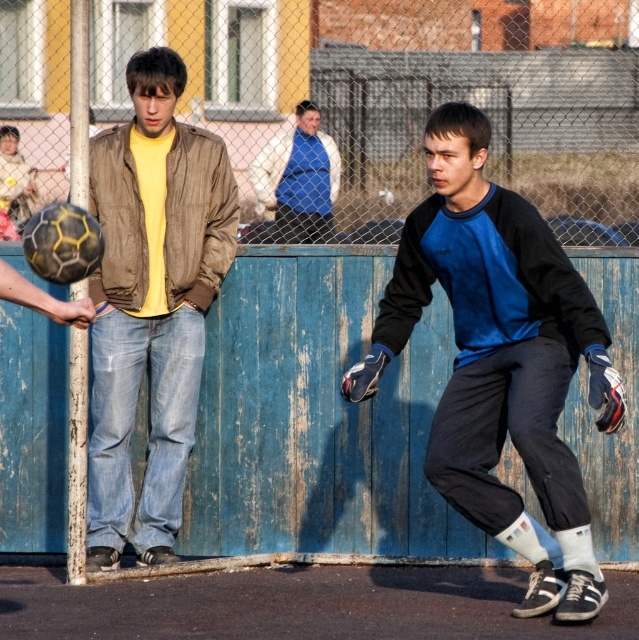
Question: Which of the following is the farthest from the observer?

Choices:
 (A) blue fleece jacket at center
 (B) blue velour jacket at center

Answer: (A)

Question: Is blue velour jacket at center below blue fleece jacket at center?

Choices:
 (A) no
 (B) yes

Answer: (B)

Question: Does blue velour jacket at center have a greater width compared to blue fleece jacket at center?

Choices:
 (A) yes
 (B) no

Answer: (A)

Question: From the image, what is the correct spatial relationship of blue velour jacket at center in relation to blue fleece jacket at center?

Choices:
 (A) right
 (B) left

Answer: (A)

Question: Among these points, which one is farthest from the camera?

Choices:
 (A) (410, 54)
 (B) (417, 205)
 (C) (210, 198)

Answer: (A)

Question: Which of the following is the closest to the observer?

Choices:
 (A) (10, 161)
 (B) (288, 224)
 (C) (583, 337)

Answer: (C)